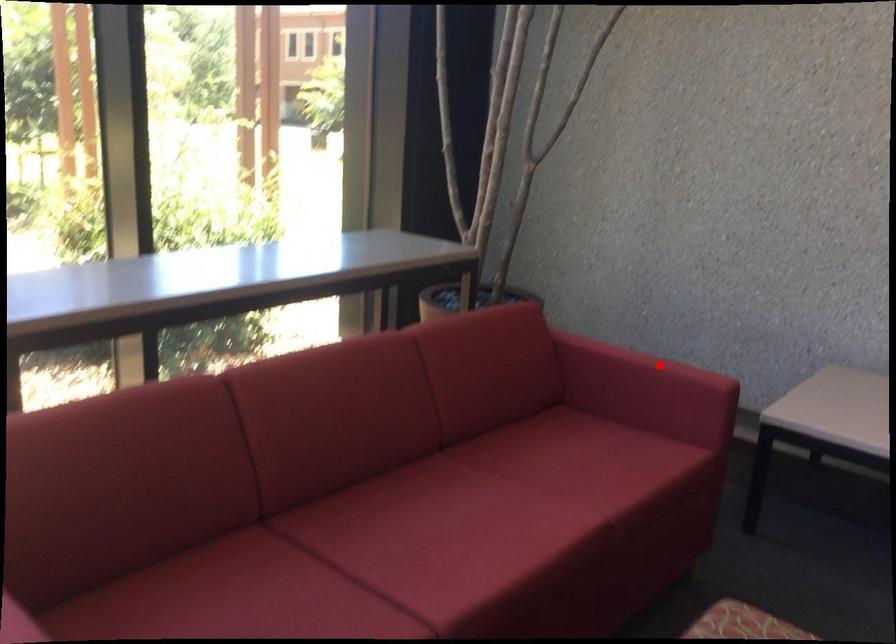
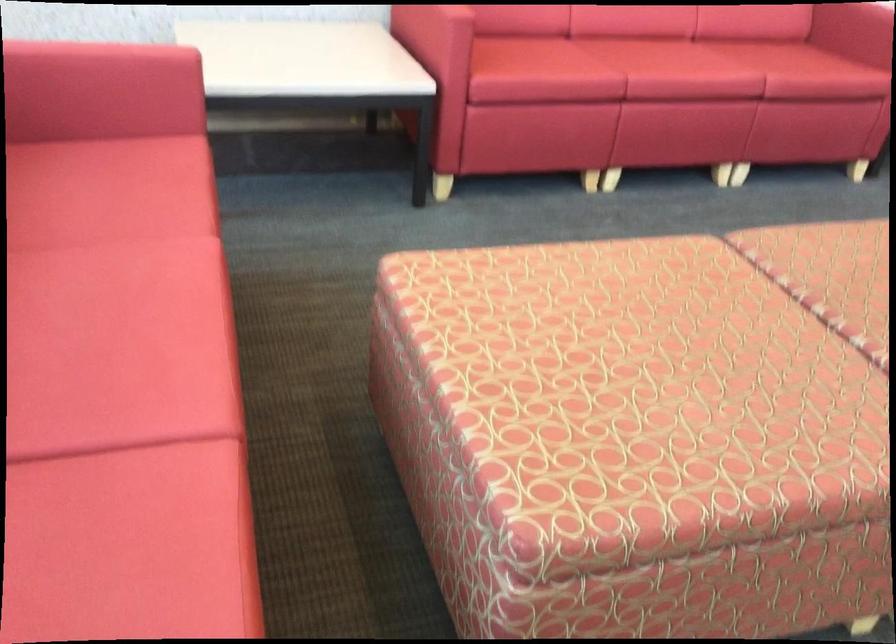
Question: I am providing you with two images of the same scene from different viewpoints. Image1 has a red point marked. In image2, the corresponding 3D location appears at what relative position? Reply with the corresponding letter.

Choices:
 (A) Closer
 (B) Farther

Answer: (A)